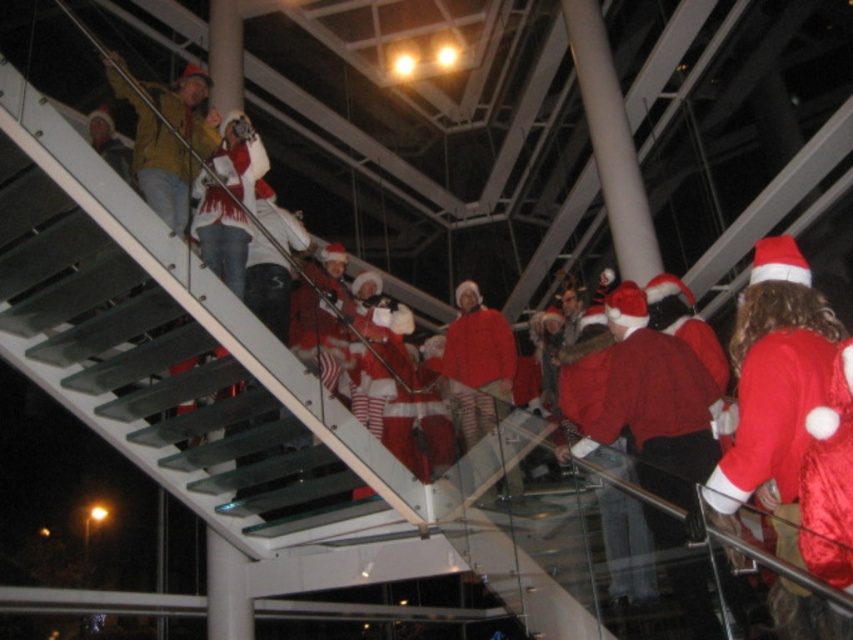
You are standing at the bottom of the staircase and see the red satin santa at right and the yellow matte jacket at upper left. Which one is positioned more to the right side of the staircase?

The red satin santa at right is positioned more to the right side of the staircase than the yellow matte jacket at upper left.